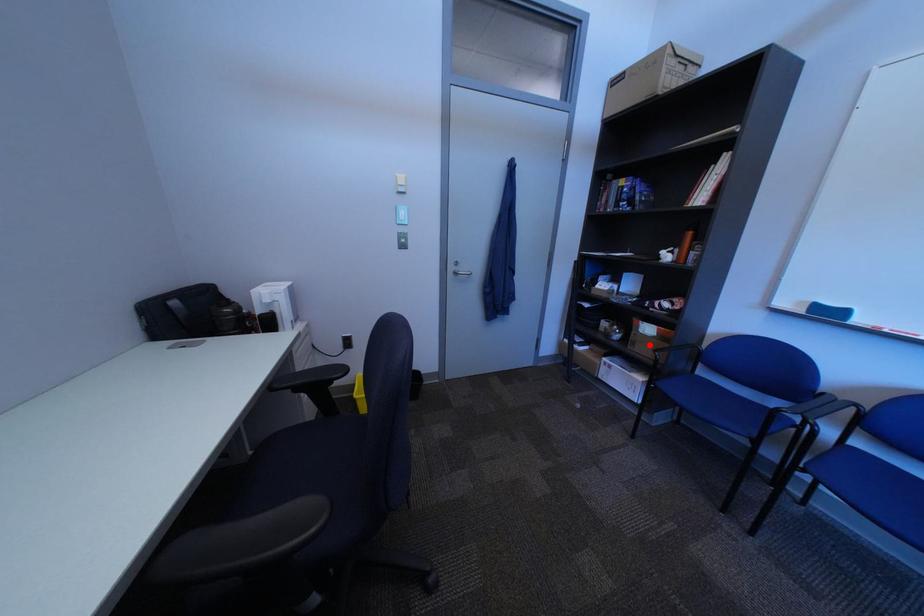
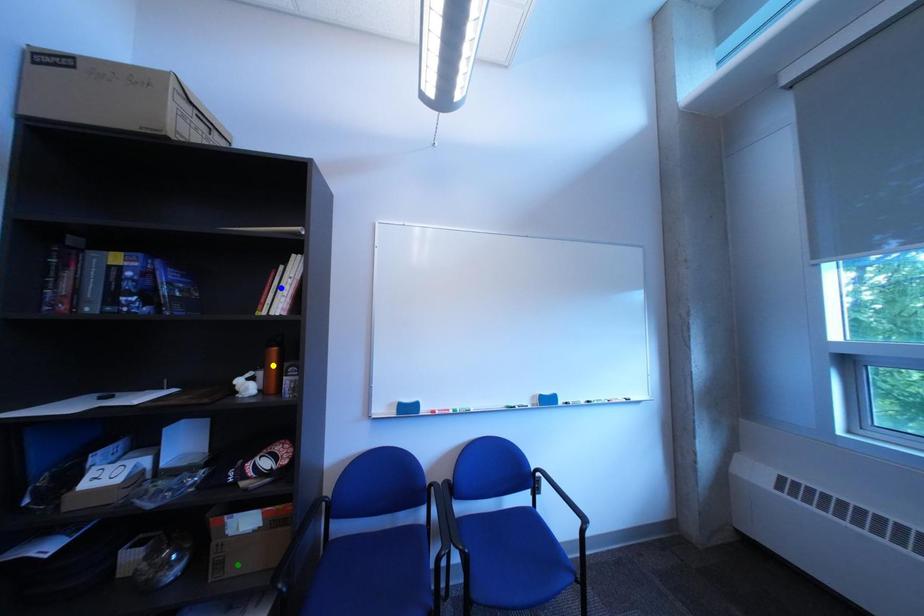
Question: I am providing you with two images of the same scene from different viewpoints. A red point is marked on the first image. You are given multiple points on the second image. Can you choose the point in image 2 that corresponds to the point in image 1?

Choices:
 (A) green point
 (B) blue point
 (C) yellow point

Answer: (A)